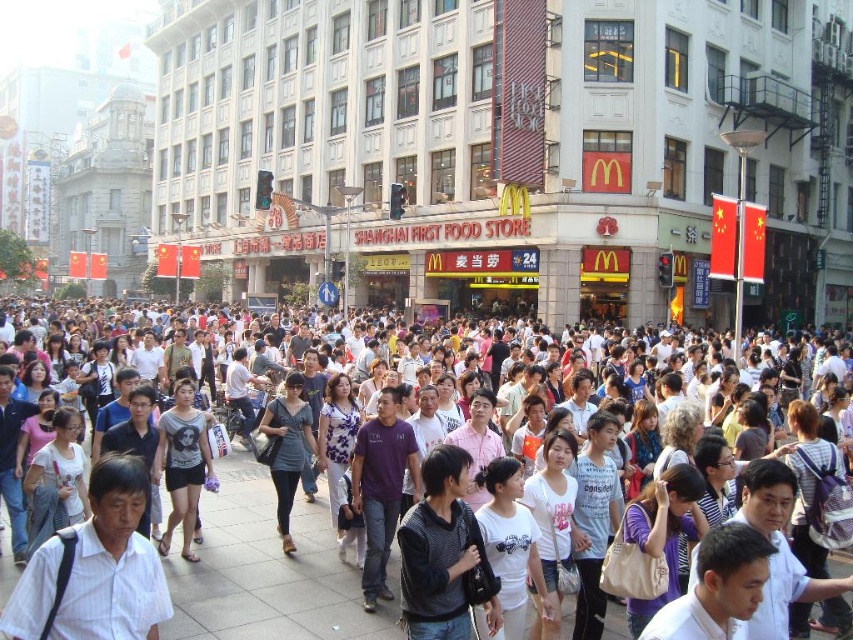
Question: Which point is closer to the camera taking this photo?

Choices:
 (A) coord(368,496)
 (B) coord(132,531)
 (C) coord(460,538)

Answer: (B)

Question: Is the position of white stone building at center less distant than that of white cotton shirt at center?

Choices:
 (A) yes
 (B) no

Answer: (B)

Question: Does matte gray t-shirt at center appear over matte gray dress at center?

Choices:
 (A) no
 (B) yes

Answer: (A)

Question: Which point is closer to the camera?

Choices:
 (A) white casual clothing at center
 (B) white stone building at center

Answer: (A)

Question: Does white cotton shirt at center have a lesser width compared to purple cotton shirt at center?

Choices:
 (A) yes
 (B) no

Answer: (A)

Question: Which point appears farthest from the camera in this image?

Choices:
 (A) (270, 465)
 (B) (403, 461)

Answer: (A)